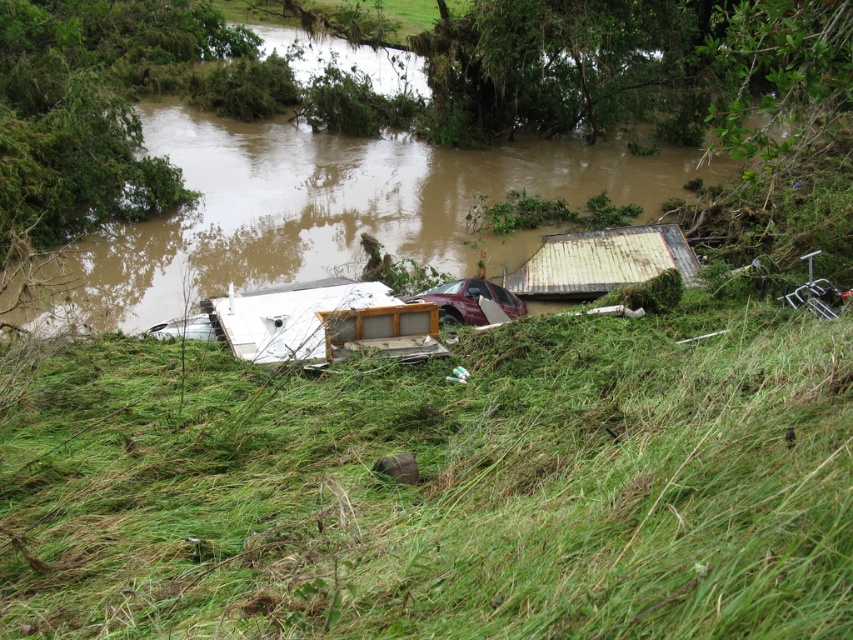
Question: Does green grassy at center have a smaller size compared to rusty corrugated metal hut at center-right?

Choices:
 (A) yes
 (B) no

Answer: (A)

Question: Does white matte cabinet at center have a larger size compared to rusty corrugated metal hut at center-right?

Choices:
 (A) yes
 (B) no

Answer: (A)

Question: Among these points, which one is nearest to the camera?

Choices:
 (A) (680, 586)
 (B) (512, 276)
 (C) (258, 317)

Answer: (A)

Question: Can you confirm if white matte cabinet at center is smaller than rusty corrugated metal hut at center-right?

Choices:
 (A) no
 (B) yes

Answer: (A)

Question: Which point is closer to the camera?

Choices:
 (A) white matte cabinet at center
 (B) rusty corrugated metal hut at center-right

Answer: (A)

Question: Which point is farther from the camera taking this photo?

Choices:
 (A) (363, 326)
 (B) (622, 490)
 (C) (650, 248)

Answer: (C)